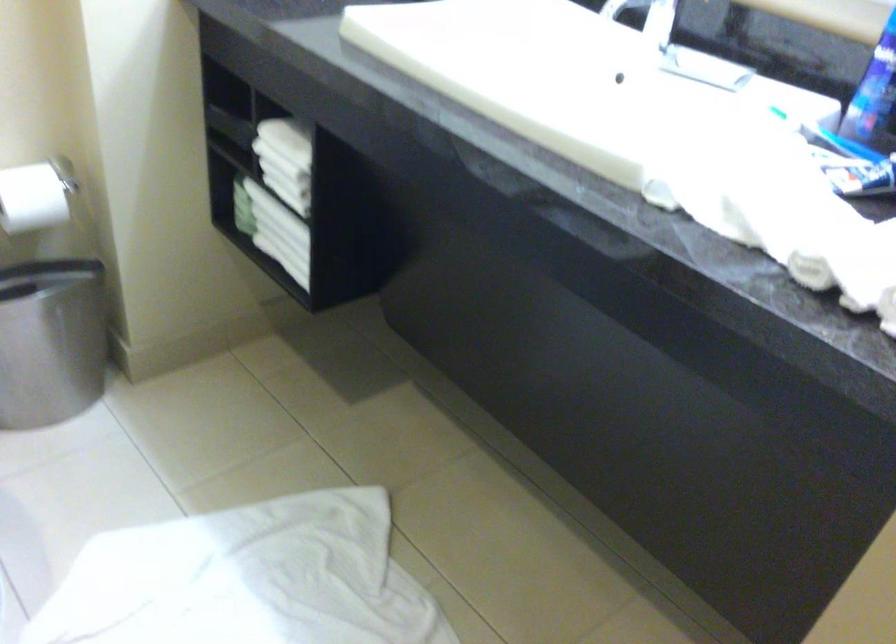
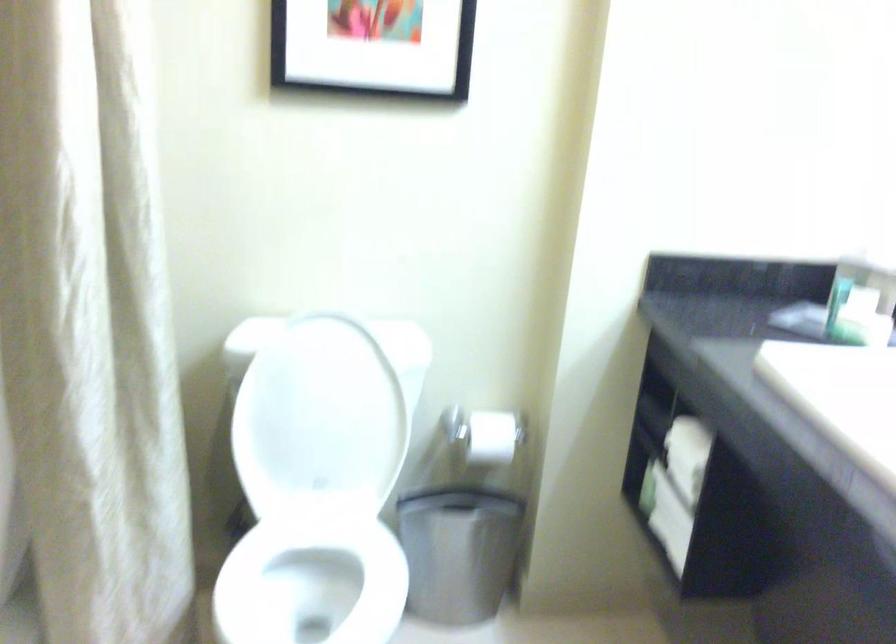
Question: How did the camera likely rotate?

Choices:
 (A) Left
 (B) Right
 (C) Up
 (D) Down

Answer: (A)